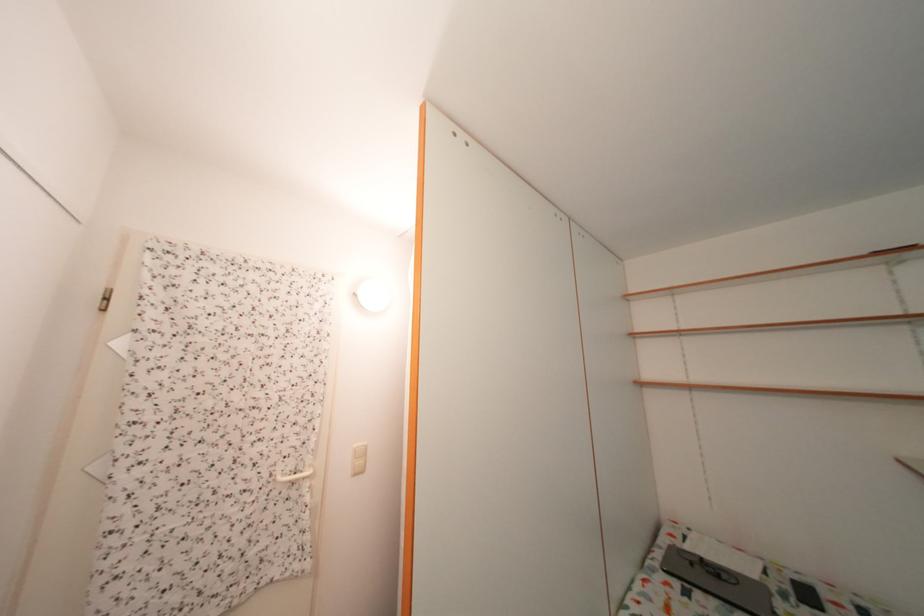
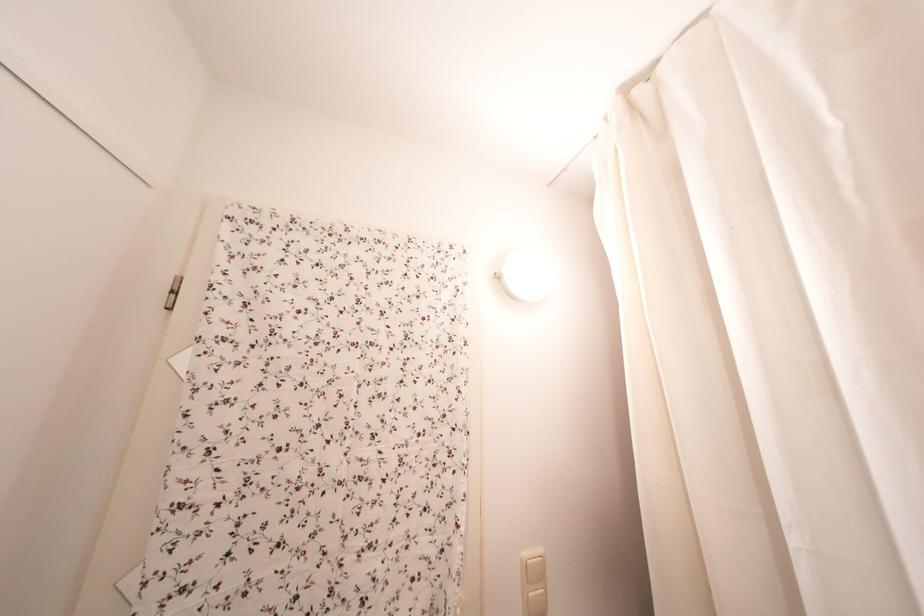
Where in the second image is the point corresponding to point (366, 451) from the first image?

(536, 560)